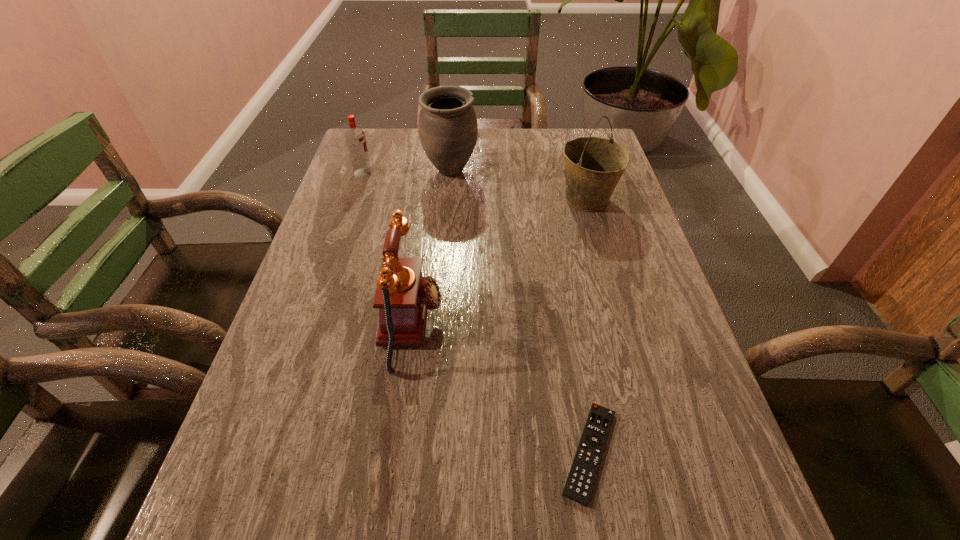
Where is `wine bucket`? wine bucket is located at coordinates (593, 166).

This screenshot has height=540, width=960. I want to click on urn, so click(448, 129).

At what (x,y) coordinates should I click in order to perform the action: click on the second nearest object. Please return your answer as a coordinate pair (x, y). The height and width of the screenshot is (540, 960). Looking at the image, I should click on (403, 294).

Find the location of a particular element. The width and height of the screenshot is (960, 540). the leftmost object is located at coordinates (355, 138).

This screenshot has height=540, width=960. Identify the location of vodka. (355, 138).

This screenshot has height=540, width=960. Find the location of `the nearest object`. the nearest object is located at coordinates (582, 476).

Find the location of `remote control`. remote control is located at coordinates (582, 476).

Where is `blank space located 0.360m on the front of the wine bucket`? The image size is (960, 540). blank space located 0.360m on the front of the wine bucket is located at coordinates (621, 322).

Identify the location of free spot located 0.070m on the right of the urn. The image size is (960, 540). tap(500, 172).

Identify the location of vacant point located on the dial of the second nearest object. (469, 325).